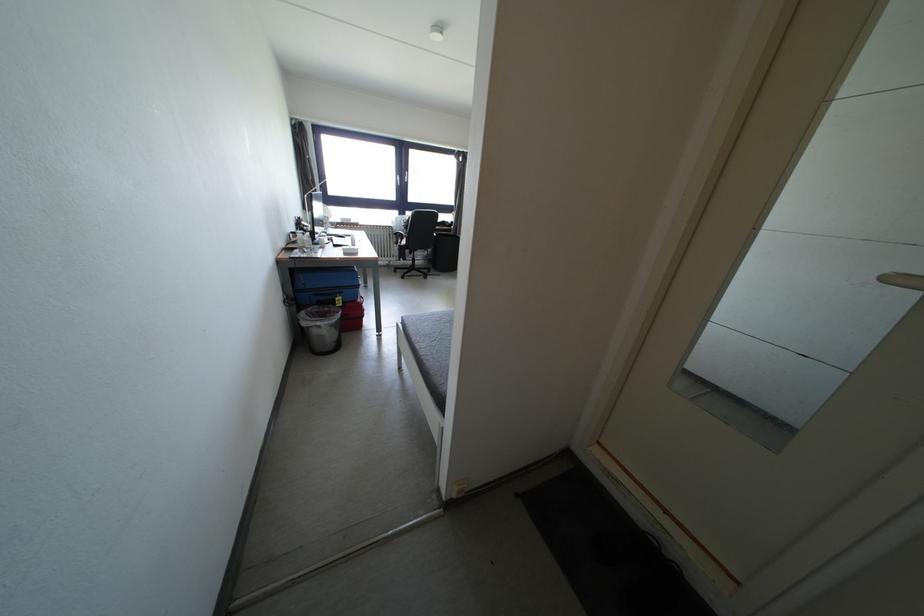
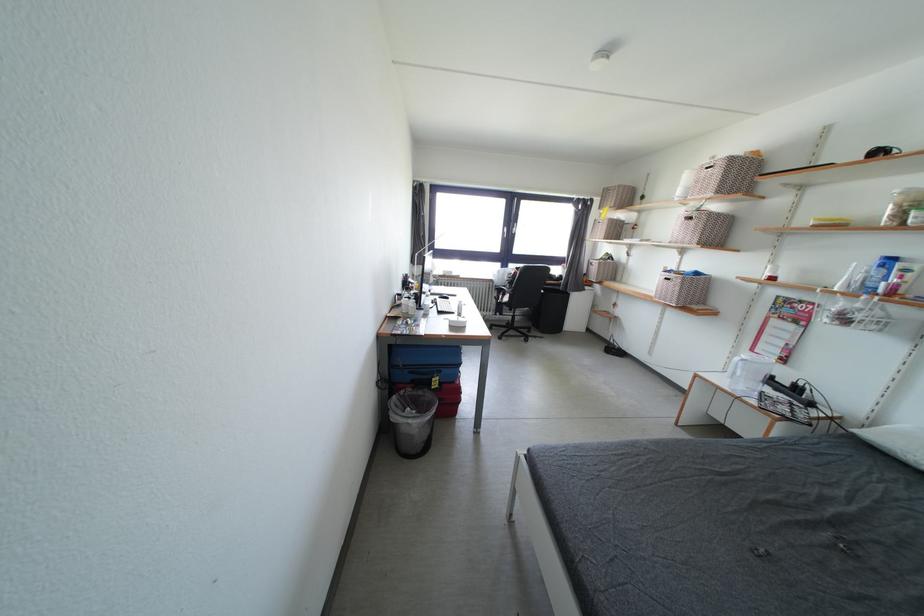
Find the pixel in the second image that matches (x=412, y=232) in the first image.

(517, 286)